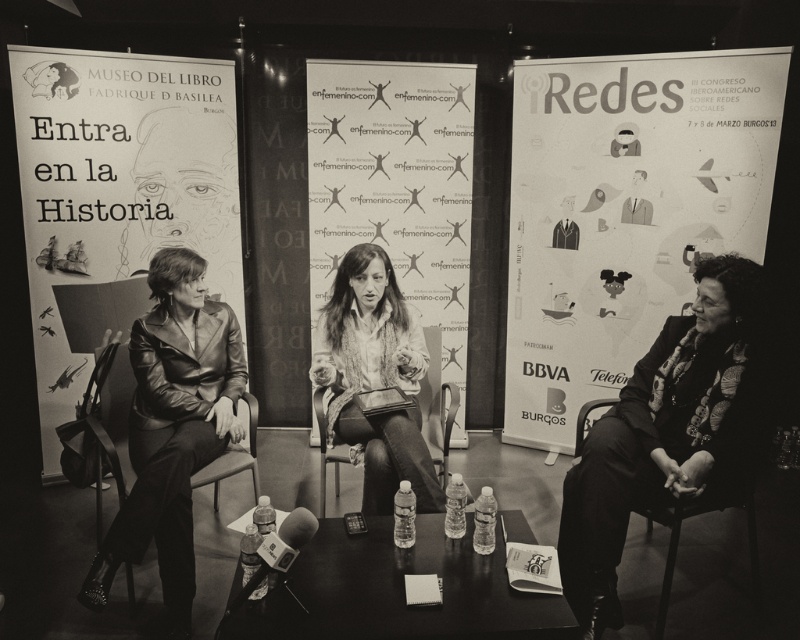
Question: Which object is the closest to the white paper at center?

Choices:
 (A) leather jacket at center
 (B) leather jacket at right
 (C) leather jacket at left
 (D) matte black banner at left

Answer: (D)

Question: Which object is positioned farthest from the matte black banner at left?

Choices:
 (A) leather jacket at center
 (B) matte paper poster at right
 (C) leather jacket at right

Answer: (C)

Question: Can you confirm if matte black banner at left is thinner than leather jacket at right?

Choices:
 (A) no
 (B) yes

Answer: (A)

Question: Considering the real-world distances, which object is farthest from the matte paper poster at right?

Choices:
 (A) leather jacket at center
 (B) matte black banner at left
 (C) white paper at center
 (D) leather jacket at left

Answer: (D)

Question: Considering the relative positions of matte paper poster at right and matte black banner at left in the image provided, where is matte paper poster at right located with respect to matte black banner at left?

Choices:
 (A) below
 (B) above

Answer: (B)

Question: Can you confirm if leather jacket at right is positioned above white paper at center?

Choices:
 (A) yes
 (B) no

Answer: (B)